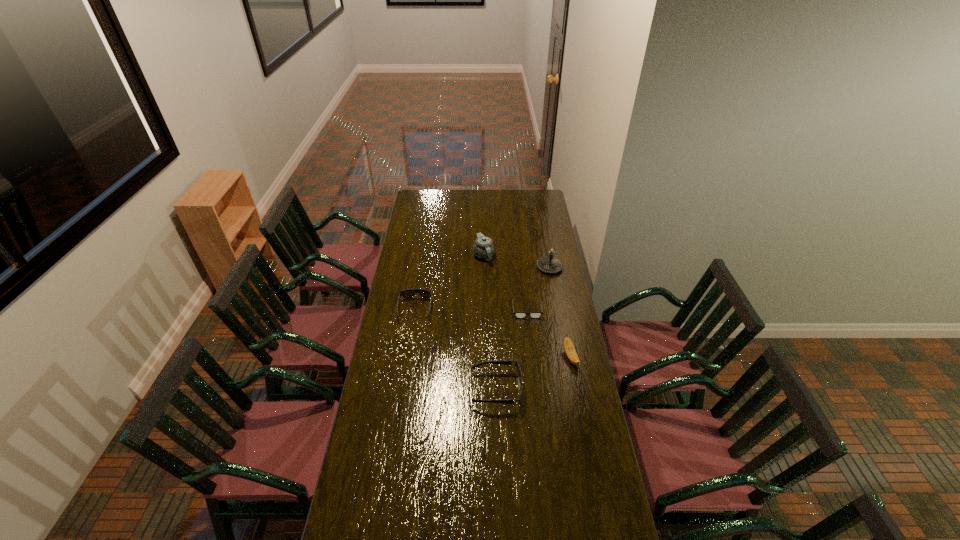
This screenshot has width=960, height=540. In order to click on vacant position in the image that satisfies the following two spatial constraints: 1. on the front side of the fourth shortest object; 2. on the front-facing side of the taller sunglasses in this screenshot , I will do `click(576, 389)`.

Where is `vacant area that satisfies the following two spatial constraints: 1. on the front side of the candle; 2. on the left side of the banana`? This screenshot has height=540, width=960. vacant area that satisfies the following two spatial constraints: 1. on the front side of the candle; 2. on the left side of the banana is located at coordinates (566, 357).